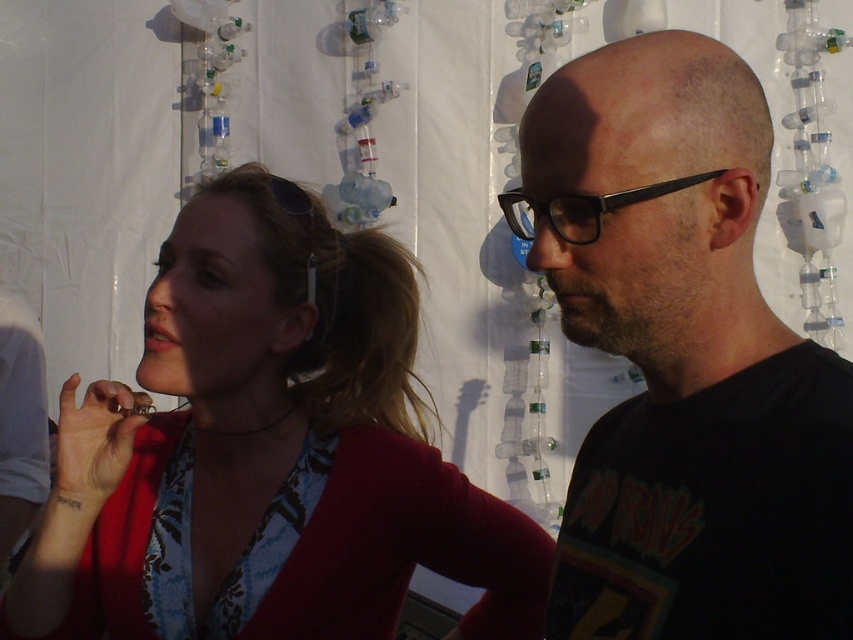
Question: From the image, what is the correct spatial relationship of black matte shirt at center in relation to black plastic glasses at center?

Choices:
 (A) above
 (B) below

Answer: (B)

Question: Which of the following is the farthest from the observer?

Choices:
 (A) matte red sweater at center
 (B) black plastic glasses at center

Answer: (A)

Question: Which point is closer to the camera?

Choices:
 (A) (648, 307)
 (B) (566, 214)
 (C) (276, 422)

Answer: (B)

Question: Can you confirm if matte red sweater at center is positioned below black plastic glasses at center?

Choices:
 (A) yes
 (B) no

Answer: (A)

Question: Is black matte shirt at center smaller than black plastic glasses at center?

Choices:
 (A) yes
 (B) no

Answer: (B)

Question: Which is nearer to the matte red sweater at center?

Choices:
 (A) black plastic glasses at center
 (B) black matte shirt at center

Answer: (B)